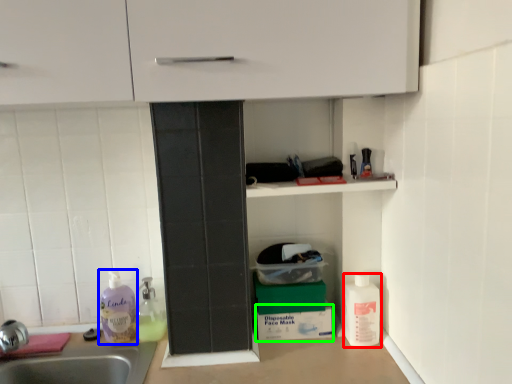
Question: Estimate the real-world distances between objects in this image. Which object is closer to cleaning product (highlighted by a red box), cleaning product (highlighted by a blue box) or cardboard box (highlighted by a green box)?

Choices:
 (A) cleaning product
 (B) cardboard box

Answer: (B)